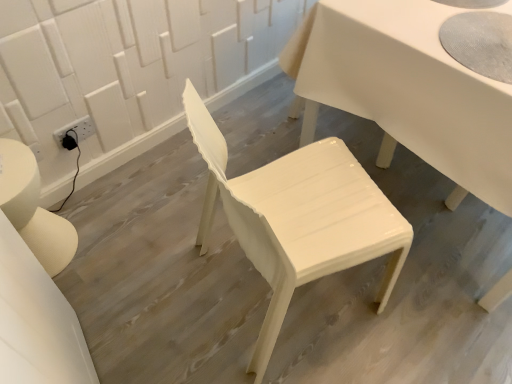
Find the location of a particular element. The width and height of the screenshot is (512, 384). vacant space underneath glossy white chair at center (from a real-world perspective) is located at coordinates (294, 291).